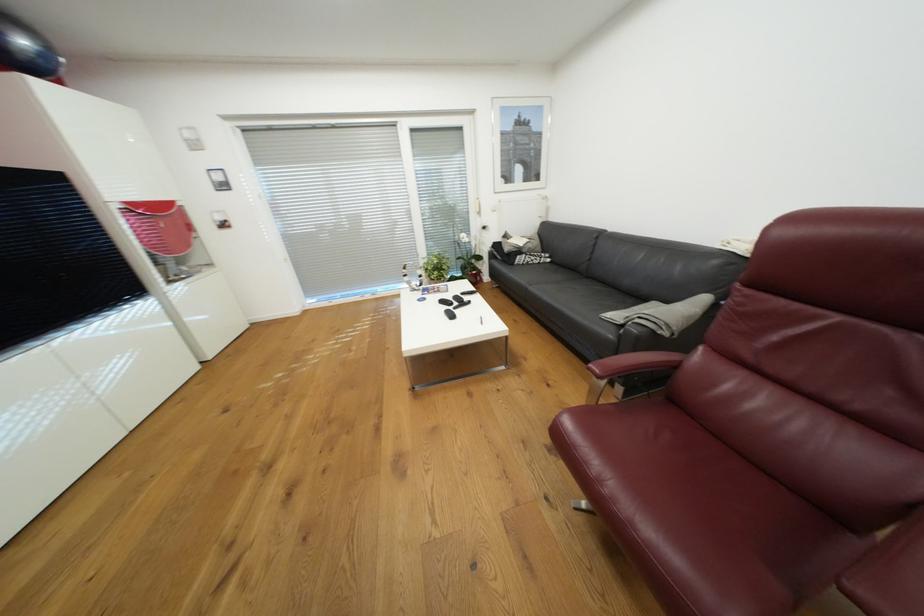
Find the location of `red chair sitting surface`. red chair sitting surface is located at coordinates (678, 482).